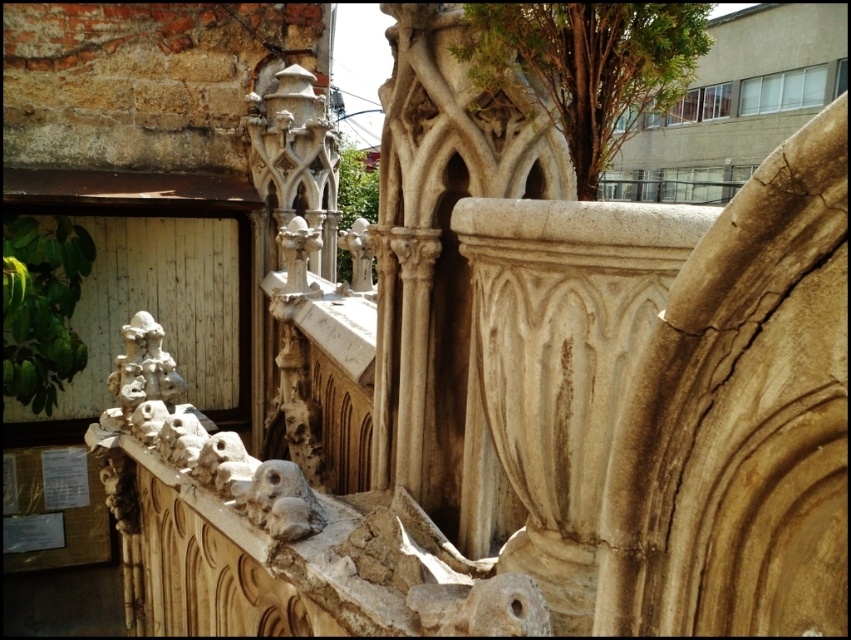
Question: Among these points, which one is nearest to the camera?

Choices:
 (A) (156, 378)
 (B) (278, 468)

Answer: (B)

Question: Which point is farther from the camera taking this photo?

Choices:
 (A) (313, 499)
 (B) (130, 356)

Answer: (B)

Question: Which object appears farthest from the camera in this image?

Choices:
 (A) stone carving at center
 (B) carved stone sculpture at lower left

Answer: (B)

Question: Is carved stone sculpture at lower left closer to the viewer compared to stone carving at center?

Choices:
 (A) no
 (B) yes

Answer: (A)

Question: From the image, what is the correct spatial relationship of carved stone sculpture at lower left in relation to stone carving at center?

Choices:
 (A) left
 (B) right

Answer: (A)

Question: Considering the relative positions of carved stone sculpture at lower left and stone carving at center in the image provided, where is carved stone sculpture at lower left located with respect to stone carving at center?

Choices:
 (A) below
 (B) above

Answer: (B)